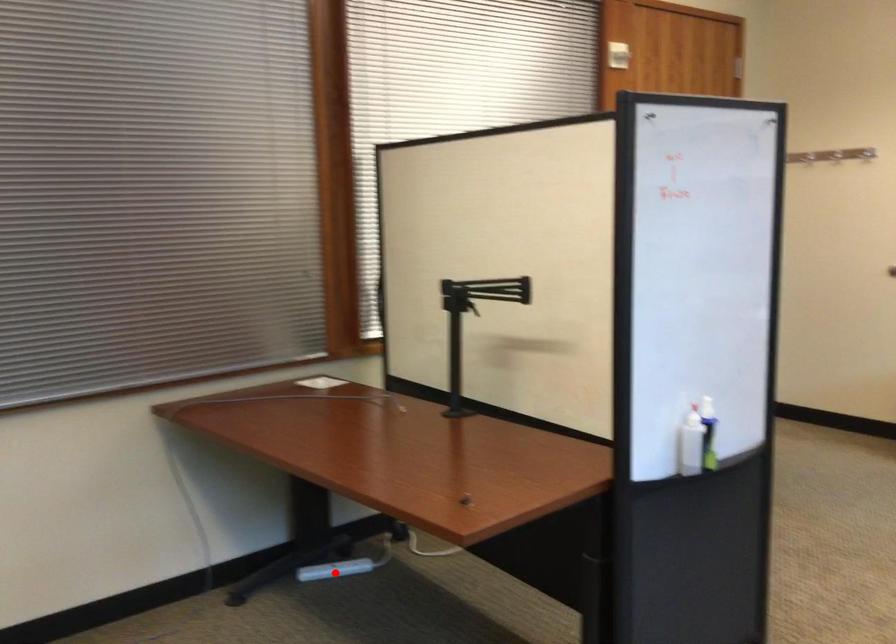
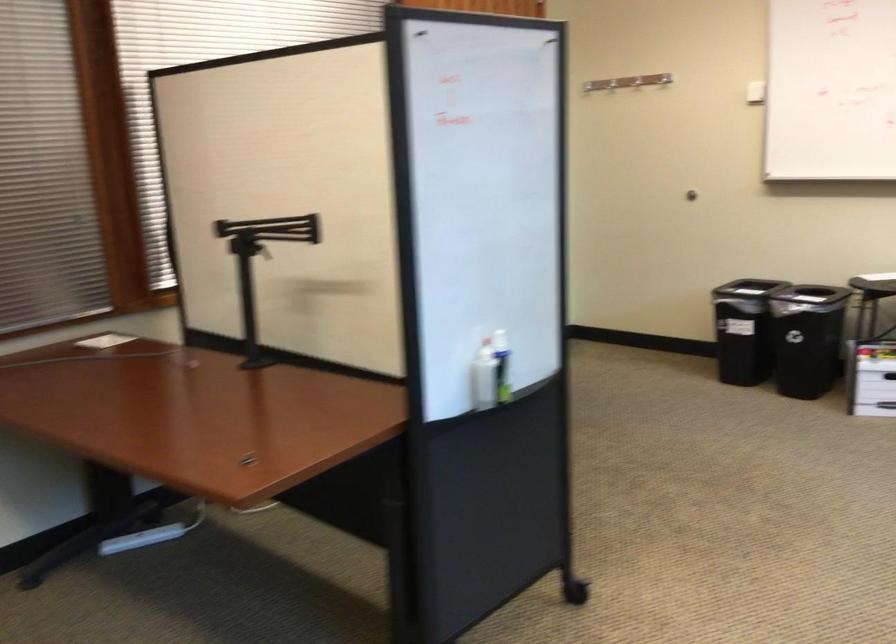
Find the pixel in the second image that matches the highlighted location in the first image.

(141, 538)